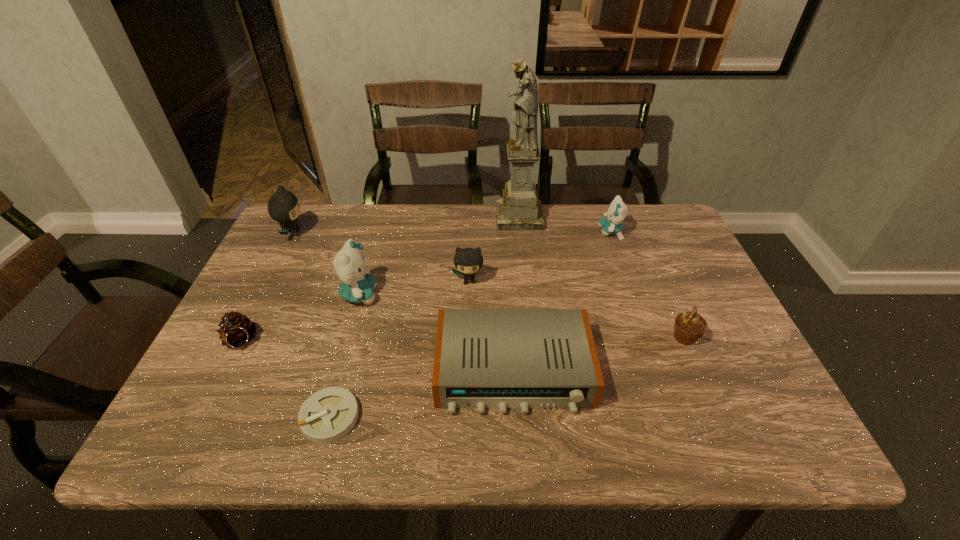
The image size is (960, 540). What are the coordinates of `ashtray located at the near edge` in the screenshot? It's located at (328, 415).

Locate an element on the screen. kitten at the left edge is located at coordinates (x=283, y=207).

In order to click on pinecone present at the left edge in this screenshot , I will do `click(236, 330)`.

Locate an element on the screen. The height and width of the screenshot is (540, 960). object positioned at the right edge is located at coordinates (689, 326).

Locate an element on the screen. object at the far left corner is located at coordinates (283, 207).

This screenshot has height=540, width=960. Identify the location of free spot at the far edge of the desktop. (396, 232).

The width and height of the screenshot is (960, 540). In the image, there is a desktop. Find the location of `blank space at the near edge`. blank space at the near edge is located at coordinates (687, 422).

Identify the location of vacant space at the left edge. (260, 300).

Locate an element on the screen. This screenshot has width=960, height=540. blank area at the right edge is located at coordinates (661, 278).

Locate an element on the screen. Image resolution: width=960 pixels, height=540 pixels. free region at the far left corner of the desktop is located at coordinates (310, 231).